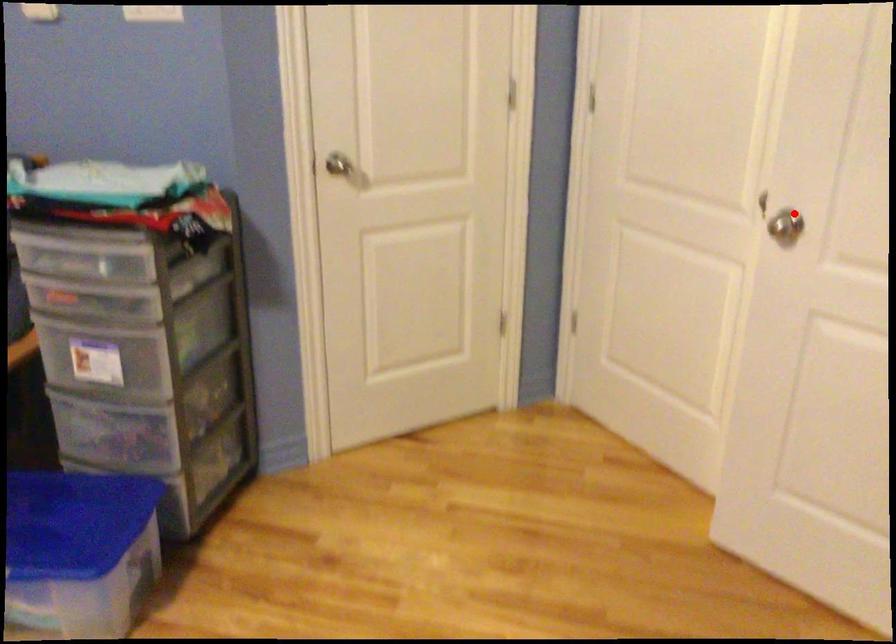
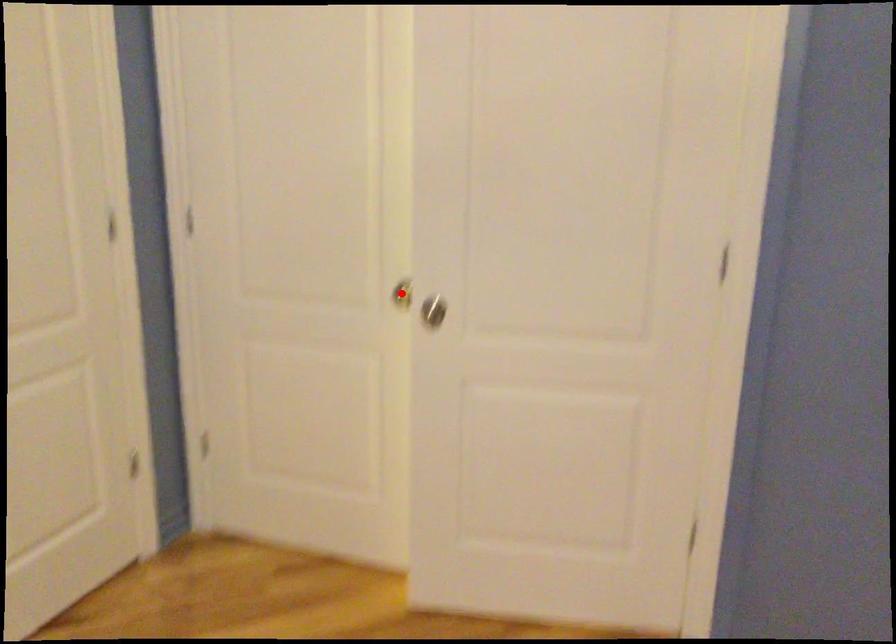
I am providing you with two images of the same scene from different viewpoints. A red point is marked on the first image and another point is marked on the second image. Does the point marked in image1 correspond to the same location as the one in image2?

No